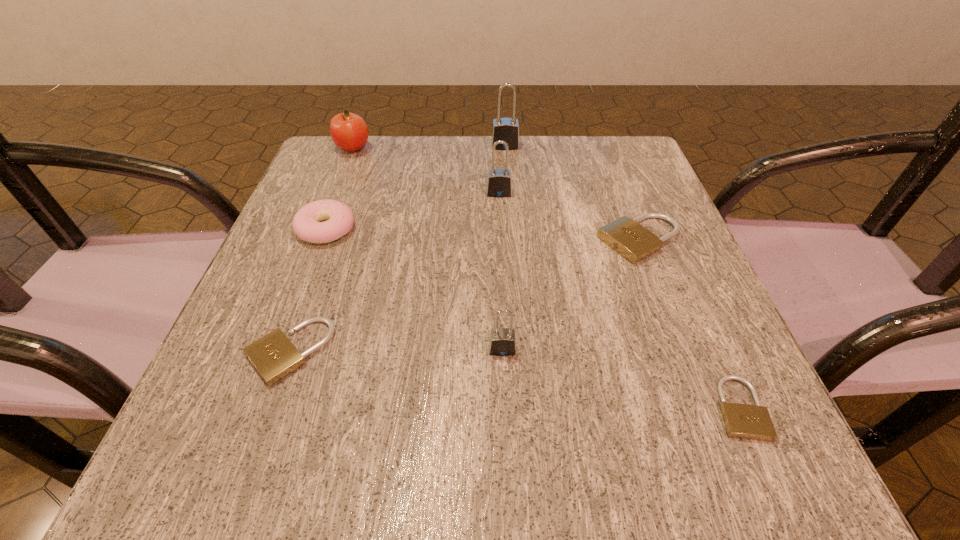
I want to click on free space between the smallest beige padlock and the tallest padlock, so click(x=622, y=277).

The image size is (960, 540). Find the location of `free space between the nearest gray padlock and the leftmost padlock`. free space between the nearest gray padlock and the leftmost padlock is located at coordinates (396, 350).

This screenshot has width=960, height=540. In order to click on unoccupied area between the tallest object and the apple in this screenshot , I will do click(x=429, y=147).

Image resolution: width=960 pixels, height=540 pixels. I want to click on vacant space that's between the pink doughnut and the fourth tallest padlock, so click(483, 234).

The height and width of the screenshot is (540, 960). Identify the location of vacant space that's between the tallest padlock and the apple. (429, 147).

At what (x,y) coordinates should I click in order to perform the action: click on vacant region between the second tallest padlock and the leftmost padlock. Please return your answer as a coordinate pair (x, y). The image size is (960, 540). Looking at the image, I should click on (395, 272).

You are a GUI agent. You are given a task and a screenshot of the screen. Output one action in this format:
    pyautogui.click(x=<x>, y=<y>)
    Task: Click on the unoccupied position between the shortest padlock and the apple
    Image resolution: width=960 pixels, height=540 pixels.
    Given the screenshot: What is the action you would take?
    pyautogui.click(x=546, y=279)

In order to click on object that stands as the closest to the shortest object in this screenshot , I will do `click(626, 236)`.

At what (x,y) coordinates should I click in order to perform the action: click on the second closest object relative to the second biggest beige padlock. Please return your answer as a coordinate pair (x, y). The width and height of the screenshot is (960, 540). Looking at the image, I should click on (502, 342).

Locate which padlock ranks second in proximity to the farthest beige padlock. Please provide its 2D coordinates. Your answer should be formatted as a tuple, i.e. [(x, y)], where the tuple contains the x and y coordinates of a point satisfying the conditions above.

[(744, 421)]